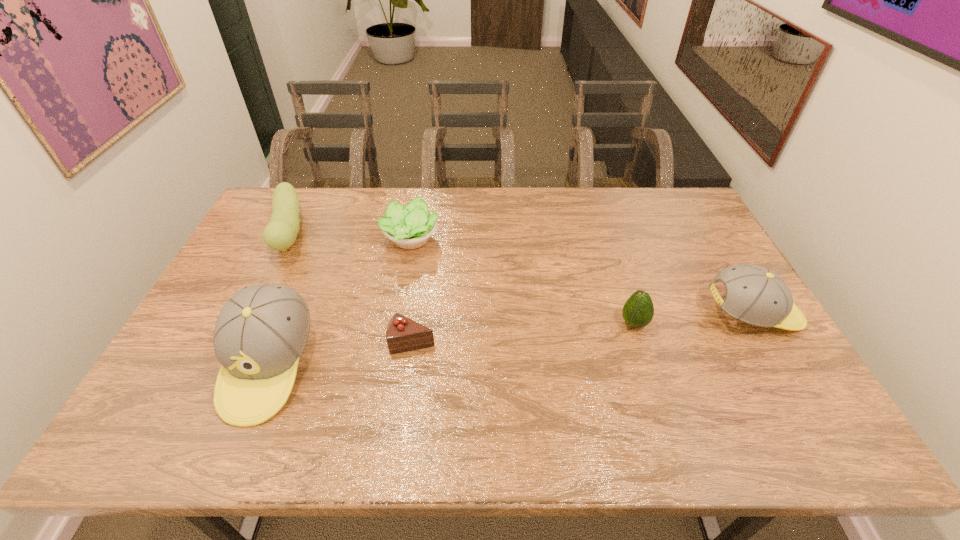
What are the coordinates of `free spot between the shortest object and the right baseball cap` in the screenshot? It's located at (583, 328).

The width and height of the screenshot is (960, 540). Find the location of `free space between the lettuce and the chocolate cake`. free space between the lettuce and the chocolate cake is located at coordinates (412, 291).

You are a GUI agent. You are given a task and a screenshot of the screen. Output one action in this format:
    pyautogui.click(x=<x>, y=<y>)
    Task: Click on the object that is the third closest to the fifth object from left to right
    
    Given the screenshot: What is the action you would take?
    pyautogui.click(x=409, y=227)

Identify which object is the fifth nearest to the taller baseball cap. Please provide its 2D coordinates. Your answer should be formatted as a tuple, i.e. [(x, y)], where the tuple contains the x and y coordinates of a point satisfying the conditions above.

[(755, 295)]

Find the location of a particular element. The image size is (960, 540). free space that satisfies the following two spatial constraints: 1. on the front side of the fifth object from left to right; 2. on the right side of the lettuce is located at coordinates (396, 324).

Identify the location of vacant area in the image that satisfies the following two spatial constraints: 1. on the front-facing side of the rightmost object; 2. on the front-facing side of the left baseball cap. (783, 366).

At what (x,y) coordinates should I click in order to perform the action: click on free space that satisfies the following two spatial constraints: 1. on the front side of the lettuce; 2. on the left side of the cucumber. Please return your answer as a coordinate pair (x, y). Image resolution: width=960 pixels, height=540 pixels. Looking at the image, I should click on (287, 240).